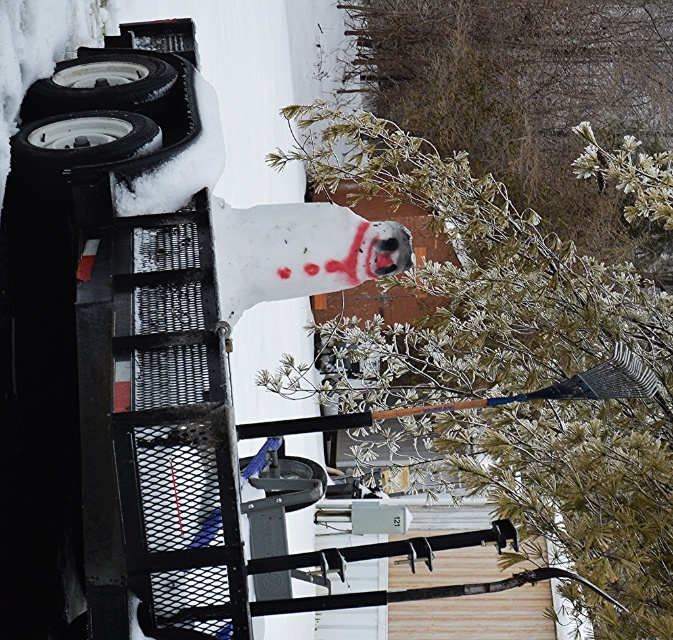
Can you confirm if frosted pine branches at upper center is thinner than white rubber tire at upper left?

No.

This screenshot has width=673, height=640. In order to click on frosted pine branches at upper center in this screenshot , I will do `click(528, 96)`.

Is point (273, 230) closer to viewer compared to point (46, 140)?

No, it is behind (46, 140).

Is white painted skull at center thinner than white rubber tire at left?

In fact, white painted skull at center might be wider than white rubber tire at left.

Between point (297, 262) and point (85, 124), which one is positioned in front?

Point (85, 124) is more forward.

This screenshot has width=673, height=640. I want to click on white painted skull at center, so click(x=297, y=252).

Who is taller, snow-covered pine at center or white rubber tire at upper left?

With more height is snow-covered pine at center.

Does point (361, 163) lie in front of point (67, 90)?

No, it is not.

This screenshot has width=673, height=640. Identify the location of snow-covered pine at center. (518, 364).